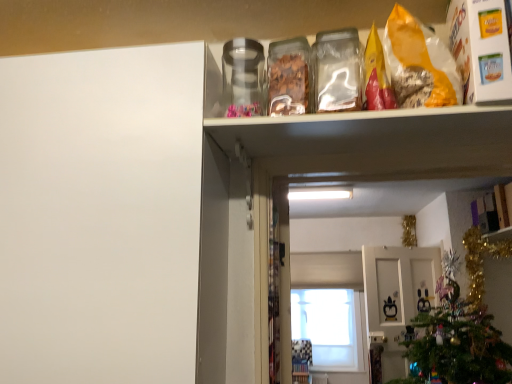
The height and width of the screenshot is (384, 512). What are the coordinates of `white matte cabinet door at left` in the screenshot? It's located at click(100, 214).

Where is `transparent glass window at center`? The height and width of the screenshot is (384, 512). transparent glass window at center is located at coordinates (331, 327).

What is the approximate height of matte white cabinet at upper right?

It is 9.10 inches.

Image resolution: width=512 pixels, height=384 pixels. Identify the location of white matte cabinet door at left. (100, 214).

From the image's perspective, is matte white cabinet at upper right located above or below white matte cabinet door at left?

From the image's perspective, matte white cabinet at upper right appears below white matte cabinet door at left.

Identify the location of cabinet that appears above the white matte cabinet door at left (from a real-world perspective). (490, 210).

Which is correct: matte white cabinet at upper right is inside white matte cabinet door at left, or outside of it?

matte white cabinet at upper right is located beyond the bounds of white matte cabinet door at left.

In terms of height, does white matte cabinet door at left look taller or shorter compared to matte white cabinet at upper right?

Considering their sizes, white matte cabinet door at left has more height than matte white cabinet at upper right.

Which of these two, white matte cabinet door at left or matte white cabinet at upper right, is smaller?

With smaller size is matte white cabinet at upper right.

Is white matte cabinet door at left in front of or behind matte white cabinet at upper right in the image?

Visually, white matte cabinet door at left is located in front of matte white cabinet at upper right.

Is matte white cabinet at upper right at the back of white matte cabinet door at left?

white matte cabinet door at left is not turned away from matte white cabinet at upper right.

Relative to matte white cabinet at upper right, is transparent glass window at center in front or behind?

transparent glass window at center is positioned farther from the viewer than matte white cabinet at upper right.

Is matte white cabinet at upper right at the back of transparent glass window at center?

No, transparent glass window at center is not facing the opposite direction of matte white cabinet at upper right.

Can you confirm if transparent glass window at center is wider than matte white cabinet at upper right?

In fact, transparent glass window at center might be narrower than matte white cabinet at upper right.

You are a GUI agent. You are given a task and a screenshot of the screen. Output one action in this format:
    pyautogui.click(x=<x>, y=<y>)
    Task: Click on the window on the left side of matte white cabinet at upper right
    The image size is (512, 384).
    Given the screenshot: What is the action you would take?
    pyautogui.click(x=331, y=327)

From the image's perspective, is white matte cabinet door at left under transparent glass window at center?

No, from the image's perspective, white matte cabinet door at left is not below transparent glass window at center.

How different are the orientations of white matte cabinet door at left and transparent glass window at center in degrees?

They differ by 1.81 degrees in their facing directions.

Do you think white matte cabinet door at left is within transparent glass window at center, or outside of it?

white matte cabinet door at left lies outside transparent glass window at center.

Can you confirm if white matte cabinet door at left is smaller than transparent glass window at center?

Incorrect, white matte cabinet door at left is not smaller in size than transparent glass window at center.

Is yellow paper bag of cereal at upper right not near white matte cabinet door at left?

They are positioned close to each other.

In the image, there is a white matte cabinet door at left. At what (x,y) coordinates should I click in order to perform the action: click on cereal above it (from the image's perspective). Please return your answer as a coordinate pair (x, y). The image size is (512, 384). Looking at the image, I should click on (419, 63).

Consider the image. From a real-world perspective, is yellow paper bag of cereal at upper right located beneath white matte cabinet door at left?

No.

Measure the distance between yellow paper bag of cereal at upper right and white matte cabinet door at left.

The distance of yellow paper bag of cereal at upper right from white matte cabinet door at left is 28.08 inches.

Looking at this image, considering the positions of objects transparent glass window at center and white matte cabinet door at left in the image provided, who is more to the right, transparent glass window at center or white matte cabinet door at left?

transparent glass window at center.

Is white matte cabinet door at left surrounded by transparent glass window at center?

No, white matte cabinet door at left is not a part of transparent glass window at center.

Considering the relative positions of transparent glass window at center and white matte cabinet door at left in the image provided, is transparent glass window at center behind white matte cabinet door at left?

Yes, transparent glass window at center is behind white matte cabinet door at left.

How many degrees apart are the facing directions of transparent glass window at center and white matte cabinet door at left?

They differ by 1.81 degrees in their facing directions.

From a real-world perspective, is matte white cabinet at upper right over transparent glass window at center?

Yes.

How different are the orientations of matte white cabinet at upper right and transparent glass window at center in degrees?

matte white cabinet at upper right and transparent glass window at center are facing 91.2 degrees away from each other.

Based on their positions, is matte white cabinet at upper right located to the left or right of transparent glass window at center?

Based on their positions, matte white cabinet at upper right is located to the right of transparent glass window at center.

From the image's perspective, between matte white cabinet at upper right and transparent glass window at center, which one is located above?

matte white cabinet at upper right.

Where is `leftover that appears on the left of matte white cabinet at upper right`? leftover that appears on the left of matte white cabinet at upper right is located at coordinates (100, 214).

Image resolution: width=512 pixels, height=384 pixels. I want to click on leftover below the matte white cabinet at upper right (from a real-world perspective), so click(x=100, y=214).

Considering their positions, is yellow paper bag of cereal at upper right positioned further to white glossy cabinet doors at center than white matte cabinet door at left?

Based on the image, white matte cabinet door at left appears to be further to white glossy cabinet doors at center.

Which object lies nearer to the anchor point white glossy cabinet doors at center, matte white cabinet at upper right or white matte cabinet door at left?

matte white cabinet at upper right lies closer to white glossy cabinet doors at center than the other object.

Considering their positions, is transparent glass window at center positioned closer to white glossy cabinet doors at center than yellow paper bag of cereal at upper right?

transparent glass window at center is closer to white glossy cabinet doors at center.

Based on their spatial positions, is transparent glass window at center or white glossy cabinet doors at center closer to matte white cabinet at upper right?

Among the two, white glossy cabinet doors at center is located nearer to matte white cabinet at upper right.

Estimate the real-world distances between objects in this image. Which object is closer to transparent glass window at center, matte white cabinet at upper right or white glossy cabinet doors at center?

white glossy cabinet doors at center lies closer to transparent glass window at center than the other object.

Looking at the image, which one is located closer to yellow paper bag of cereal at upper right, transparent glass window at center or white matte cabinet door at left?

white matte cabinet door at left.

Estimate the real-world distances between objects in this image. Which object is closer to matte white cabinet at upper right, yellow paper bag of cereal at upper right or white matte cabinet door at left?

yellow paper bag of cereal at upper right is closer to matte white cabinet at upper right.

Estimate the real-world distances between objects in this image. Which object is further from yellow paper bag of cereal at upper right, white glossy cabinet doors at center or transparent glass window at center?

transparent glass window at center is further to yellow paper bag of cereal at upper right.

The image size is (512, 384). Find the location of `window between yellow paper bag of cereal at upper right and white glossy cabinet doors at center from front to back`. window between yellow paper bag of cereal at upper right and white glossy cabinet doors at center from front to back is located at coordinates (331, 327).

The height and width of the screenshot is (384, 512). I want to click on cabinet positioned between yellow paper bag of cereal at upper right and white glossy cabinet doors at center from near to far, so click(490, 210).

At what (x,y) coordinates should I click in order to perform the action: click on cereal situated between white matte cabinet door at left and matte white cabinet at upper right from left to right. Please return your answer as a coordinate pair (x, y). Looking at the image, I should click on (419, 63).

Where is `door between transparent glass window at center and matte white cabinet at upper right`? Image resolution: width=512 pixels, height=384 pixels. door between transparent glass window at center and matte white cabinet at upper right is located at coordinates (397, 296).